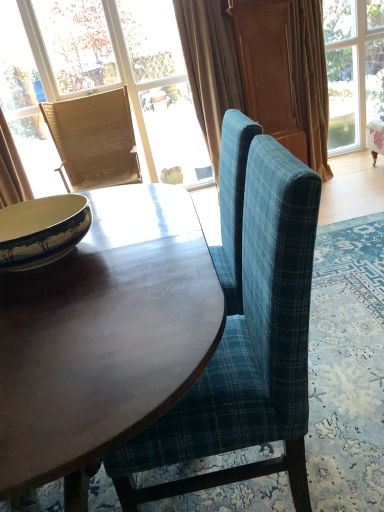
Where is `vacant area that is in front of yellow glazed bowl at left`? vacant area that is in front of yellow glazed bowl at left is located at coordinates (61, 304).